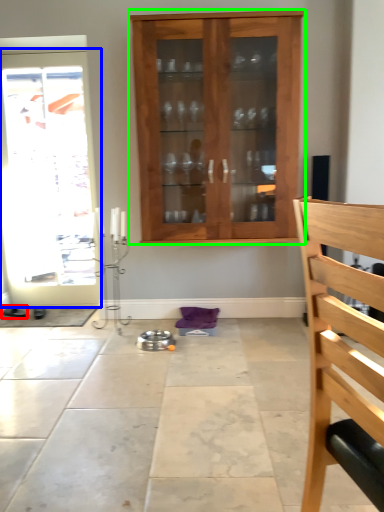
Question: Estimate the real-world distances between objects in this image. Which object is farther from footwear (highlighted by a red box), door (highlighted by a blue box) or cabinetry (highlighted by a green box)?

Choices:
 (A) door
 (B) cabinetry

Answer: (B)